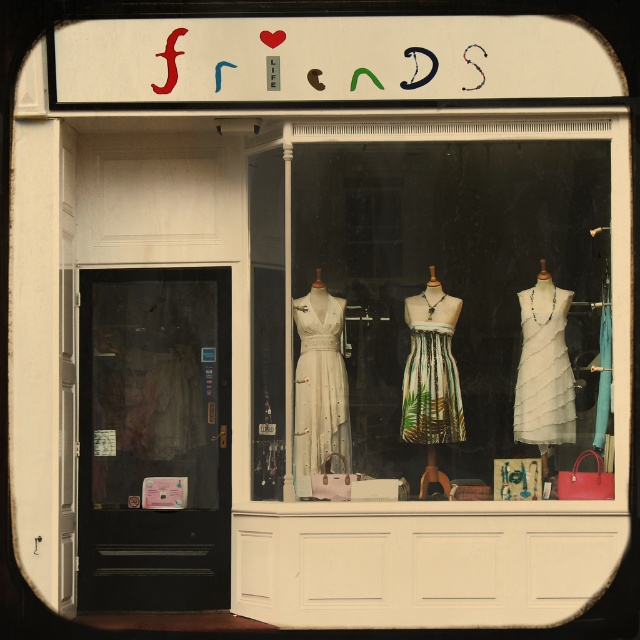
Is point (429, 168) positioned after point (408, 426)?

Yes, point (429, 168) is farther from viewer.

In the scene shown: Who is more distant from viewer, (x=616, y=330) or (x=438, y=348)?

The point (x=438, y=348) is more distant.

The image size is (640, 640). What are the coordinates of `white fabric dress at center` in the screenshot? It's located at (435, 310).

Is point (310, 406) farther from camera compared to point (433, 378)?

No, (310, 406) is closer to viewer.

Can you confirm if light beige fabric dress at center is taller than printed fabric dress at center?

Yes, light beige fabric dress at center is taller than printed fabric dress at center.

Identify the location of light beige fabric dress at center. (320, 384).

You are a GUI agent. You are given a task and a screenshot of the screen. Output one action in this format:
    pyautogui.click(x=<x>, y=<y>)
    Task: Click on the light beige fabric dress at center
    
    Given the screenshot: What is the action you would take?
    pyautogui.click(x=320, y=384)

Does white fabric dress at center appear on the left side of light beige fabric dress at center?

No, white fabric dress at center is not to the left of light beige fabric dress at center.

This screenshot has width=640, height=640. Describe the element at coordinates (435, 310) in the screenshot. I see `white fabric dress at center` at that location.

Describe the element at coordinates (435, 310) in the screenshot. I see `white fabric dress at center` at that location.

Where is `white fabric dress at center`? This screenshot has height=640, width=640. white fabric dress at center is located at coordinates (435, 310).